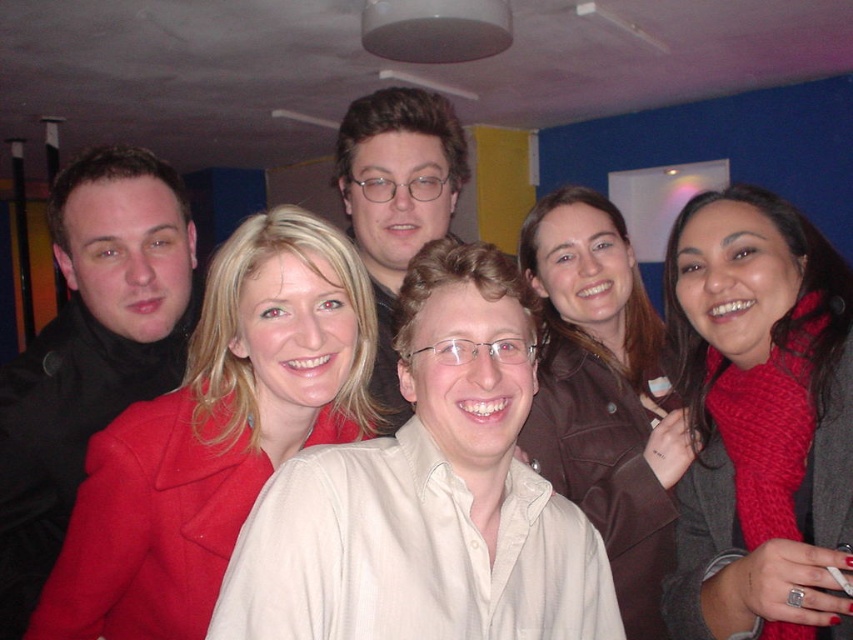
You are a photographer standing at the camera position. You want to adjust the focus to the matte black jacket at left. Is the jacket within the standard 1.5 meters focusing range of the camera?

The matte black jacket at left is 1.22 meters away from the camera, which is within the standard 1.5 meters focusing range. Therefore, the jacket can be focused on properly.

You are a photographer at this event and want to adjust your camera to focus on the matte black jacket at left without the brown leather jacket at upper center being in the foreground. Is this possible given their positions?

The matte black jacket at left is in front of the brown leather jacket at upper center, so adjusting the camera focus to only the matte black jacket at left while excluding the brown leather jacket at upper center in the foreground may not be possible since the matte black jacket is already in front, making the brown leather jacket at upper center the background.